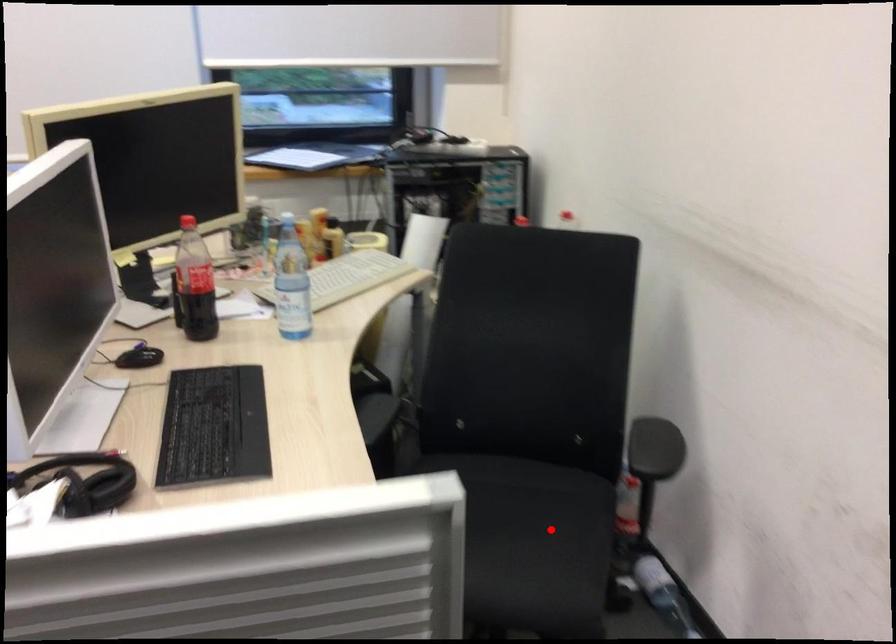
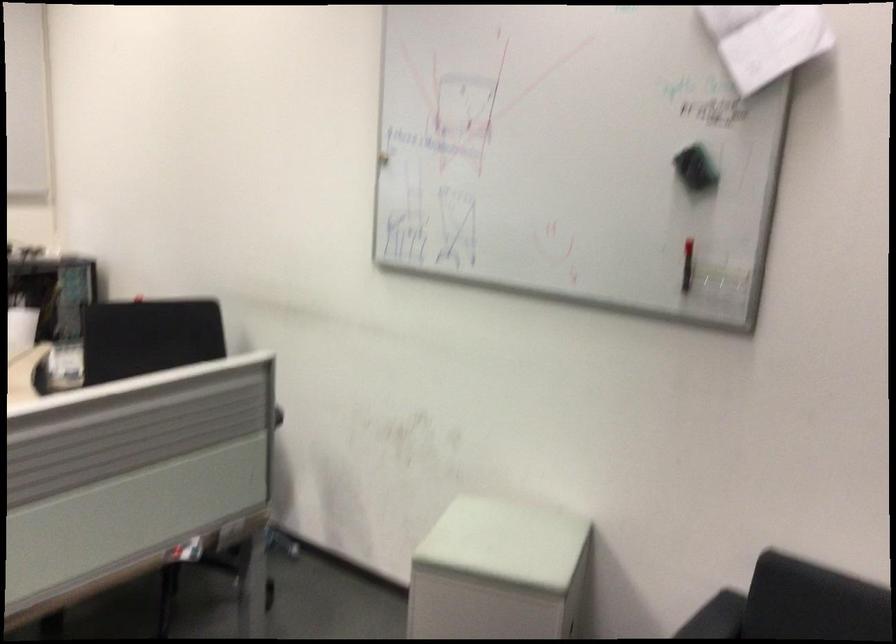
Question: I am providing you with two images of the same scene from different viewpoints. A red point is marked on the first image. At the location where the point appears in image 1, is it still visible in image 2?

Choices:
 (A) Yes
 (B) No

Answer: (B)